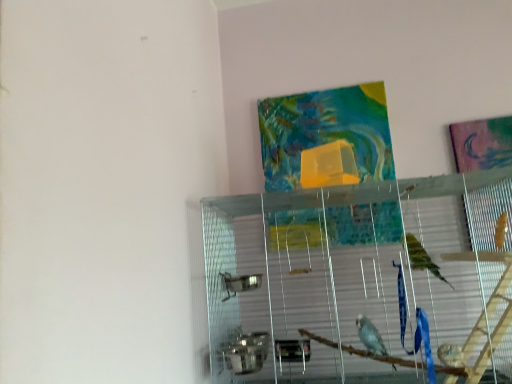
Question: Is textured fabric tapestry at upper center facing towards clear glass cage at center?

Choices:
 (A) no
 (B) yes

Answer: (A)

Question: Can you confirm if textured fabric tapestry at upper center is bigger than clear glass cage at center?

Choices:
 (A) yes
 (B) no

Answer: (B)

Question: Is textured fabric tapestry at upper center looking in the opposite direction of clear glass cage at center?

Choices:
 (A) no
 (B) yes

Answer: (A)

Question: Considering the relative sizes of textured fabric tapestry at upper center and clear glass cage at center in the image provided, is textured fabric tapestry at upper center wider than clear glass cage at center?

Choices:
 (A) yes
 (B) no

Answer: (B)

Question: Can you confirm if textured fabric tapestry at upper center is thinner than clear glass cage at center?

Choices:
 (A) no
 (B) yes

Answer: (B)

Question: Does textured fabric tapestry at upper center have a greater height compared to clear glass cage at center?

Choices:
 (A) no
 (B) yes

Answer: (A)

Question: Is clear glass cage at center oriented away from textured fabric tapestry at upper center?

Choices:
 (A) yes
 (B) no

Answer: (B)

Question: Could textured fabric tapestry at upper center be considered to be inside clear glass cage at center?

Choices:
 (A) no
 (B) yes

Answer: (A)

Question: Considering the relative sizes of clear glass cage at center and textured fabric tapestry at upper center in the image provided, is clear glass cage at center smaller than textured fabric tapestry at upper center?

Choices:
 (A) yes
 (B) no

Answer: (B)

Question: From a real-world perspective, is clear glass cage at center located higher than textured fabric tapestry at upper center?

Choices:
 (A) yes
 (B) no

Answer: (B)

Question: Does clear glass cage at center have a lesser height compared to textured fabric tapestry at upper center?

Choices:
 (A) no
 (B) yes

Answer: (A)

Question: From the image's perspective, would you say clear glass cage at center is shown under textured fabric tapestry at upper center?

Choices:
 (A) yes
 (B) no

Answer: (A)

Question: Considering the positions of textured fabric tapestry at upper center and clear glass cage at center in the image, is textured fabric tapestry at upper center taller or shorter than clear glass cage at center?

Choices:
 (A) tall
 (B) short

Answer: (B)